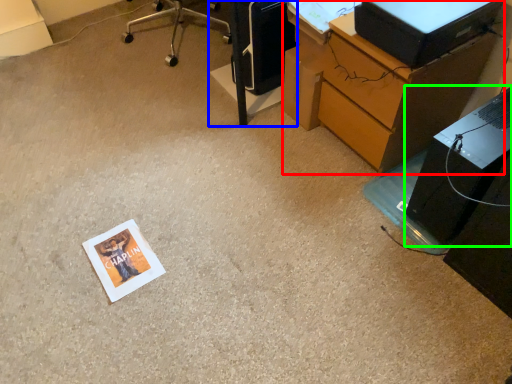
Question: Considering the real-world distances, which object is farthest from desk (highlighted by a red box)? furniture (highlighted by a blue box) or computer tower (highlighted by a green box)?

Choices:
 (A) furniture
 (B) computer tower

Answer: (A)